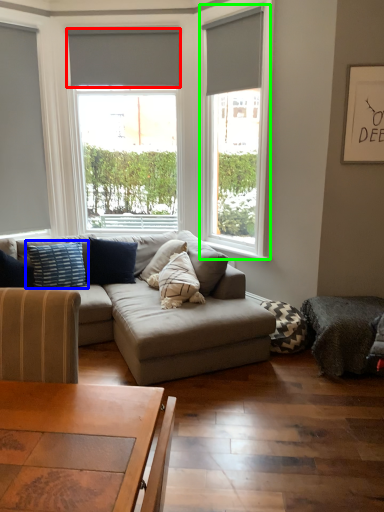
Question: Which object is the farthest from blind (highlighted by a red box)? Choose among these: pillow (highlighted by a blue box) or window (highlighted by a green box).

Choices:
 (A) pillow
 (B) window

Answer: (A)